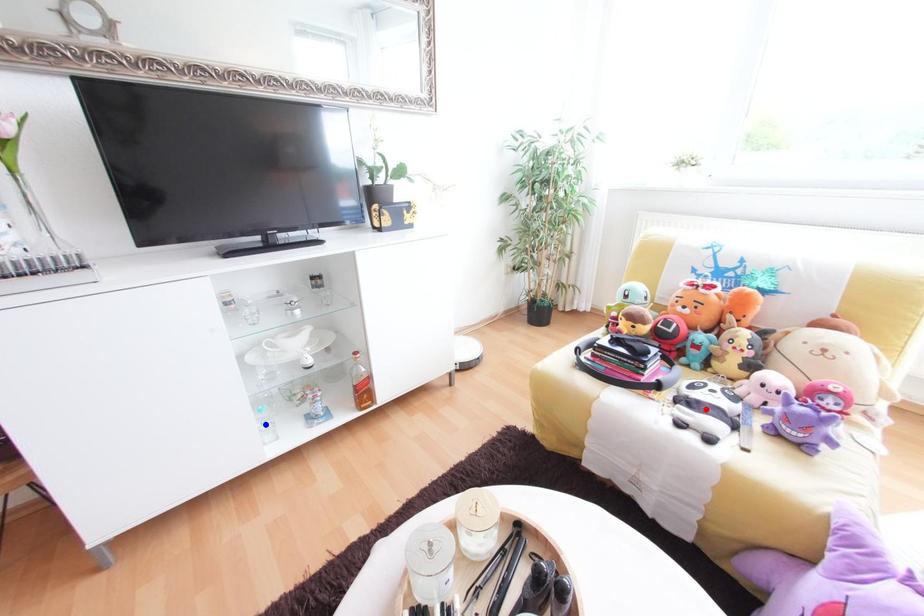
Question: Which of the two points in the image is closer to the camera?

Choices:
 (A) Blue point is closer.
 (B) Red point is closer.

Answer: (B)